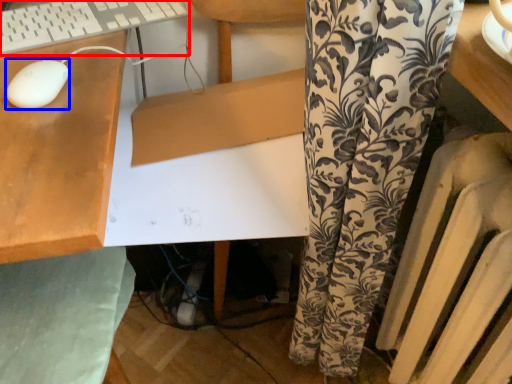
Question: Which object appears farthest to the camera in this image, computer keyboard (highlighted by a red box) or mouse (highlighted by a blue box)?

Choices:
 (A) computer keyboard
 (B) mouse

Answer: (A)